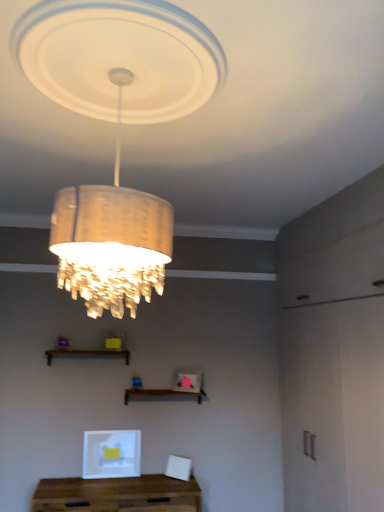
Question: Is brown wooden shelf at center, the 1th shelf when ordered from right to left, bigger or smaller than matte gold chandelier at upper center?

Choices:
 (A) small
 (B) big

Answer: (A)

Question: Which is correct: brown wooden shelf at center, the 1th shelf when ordered from right to left, is inside matte gold chandelier at upper center, or outside of it?

Choices:
 (A) inside
 (B) outside

Answer: (B)

Question: Based on their relative distances, which object is nearer to the matte gold chandelier at upper center?

Choices:
 (A) wooden table at lower center
 (B) wooden shelf at lower center, acting as the 1th shelf starting from the top
 (C) brown wooden shelf at center, the 1th shelf when ordered from right to left

Answer: (B)

Question: Estimate the real-world distances between objects in this image. Which object is closer to the brown wooden shelf at center, marked as the 2th shelf in a top-to-bottom arrangement?

Choices:
 (A) matte gold chandelier at upper center
 (B) wooden shelf at lower center, the 2th shelf when ordered from bottom to top
 (C) wooden table at lower center

Answer: (B)